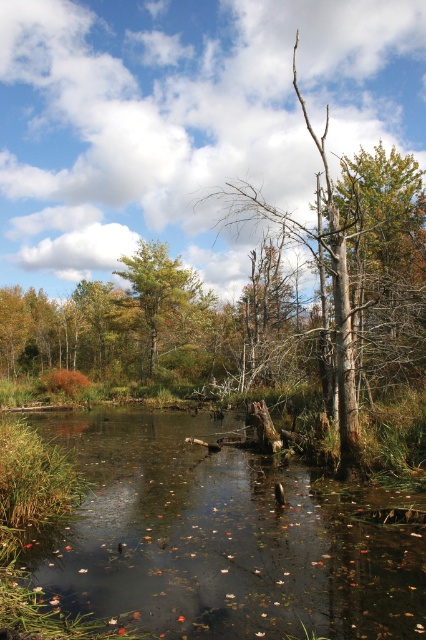
The width and height of the screenshot is (426, 640). What are the coordinates of `brown bark tree at center` in the screenshot? It's located at (360, 269).

Does point (253, 205) come behind point (186, 298)?

Yes, point (253, 205) is behind point (186, 298).

In order to click on brown bark tree at center in this screenshot , I will do `click(360, 269)`.

Does point (330, 520) come closer to viewer compared to point (158, 308)?

That is True.

What do you see at coordinates (221, 538) in the screenshot? The height and width of the screenshot is (640, 426). I see `brown murky water at center` at bounding box center [221, 538].

I want to click on brown murky water at center, so coord(221,538).

Is point (152, 516) positioned before point (402, 232)?

Yes, point (152, 516) is in front of point (402, 232).

Who is more distant from viewer, (x=173, y=448) or (x=331, y=401)?

Point (x=331, y=401)

The width and height of the screenshot is (426, 640). In order to click on brown murky water at center in this screenshot , I will do `click(221, 538)`.